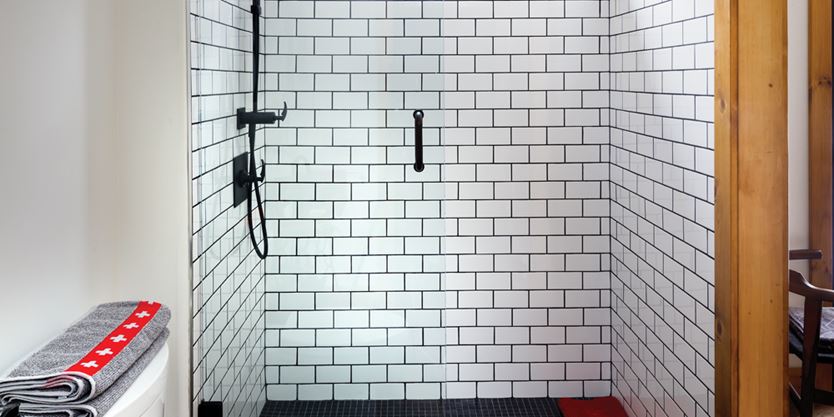
Where is `knobs`? The width and height of the screenshot is (834, 417). knobs is located at coordinates (284, 111), (264, 171).